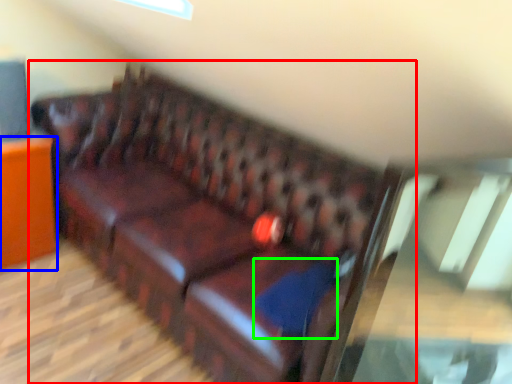
Question: Which object is positioned closest to studio couch (highlighted by a red box)? Select from furniture (highlighted by a blue box) and pillow (highlighted by a green box).

Choices:
 (A) furniture
 (B) pillow

Answer: (B)